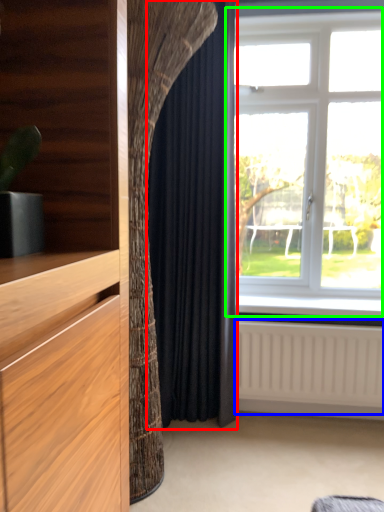
Question: Which object is positioned farthest from curtain (highlighted by a red box)? Select from radiator (highlighted by a blue box) and window (highlighted by a green box).

Choices:
 (A) radiator
 (B) window

Answer: (B)